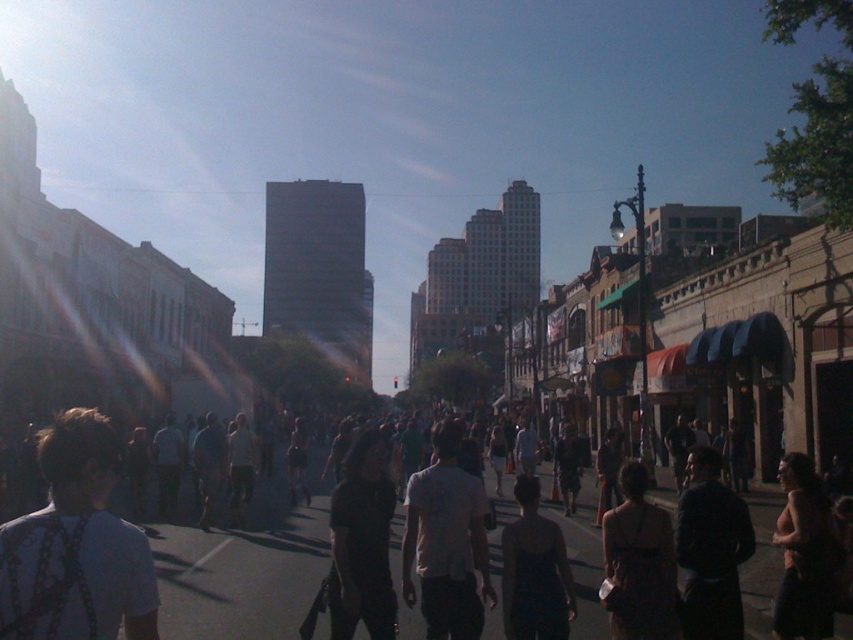
You are a photographer standing on the street and want to take a photo of the dark gray clothing at center and the white matte shirt at center. Which one will appear larger in your photo?

The dark gray clothing at center will appear larger in the photo because it is closer to the viewer than the white matte shirt at center.

You are a photographer standing at the center of the street. You want to take a photo of the dark gray clothing at center. Where should you aim your camera to capture it?

The dark gray clothing at center is located at the 2D coordinates point (135, 561), so aim your camera towards that point to capture it.

You are a delivery person who needs to pick up a package from a location marked by the white fabric bag at lower left. The GPS coordinates for the bag are given as point 0.855, 0.090. If the street runs from left to right, which direction should you head to reach the bag?

The white fabric bag at lower left is located at point (76, 547). Since the street runs from left to right and the bag is at the lower left, you should head towards the left direction to reach it.